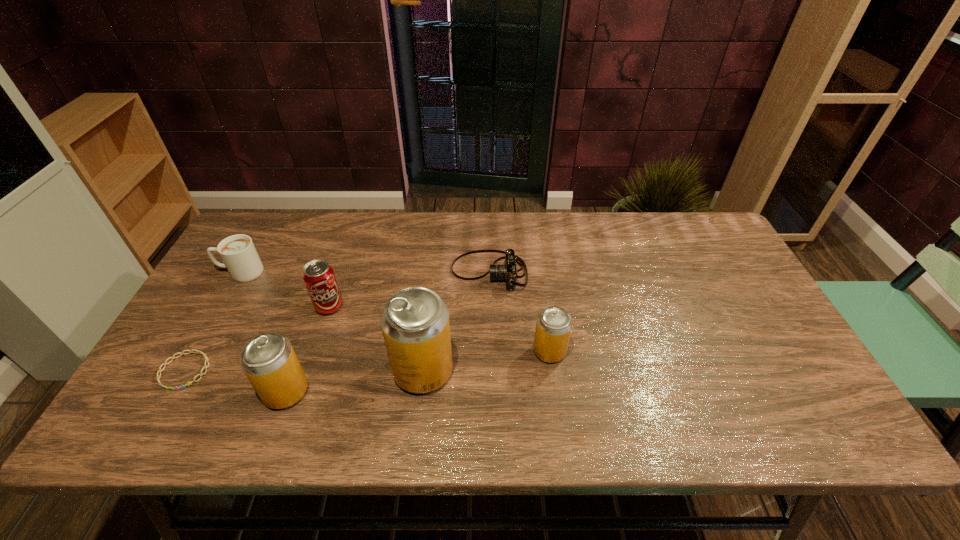
Please point out where to position a new pop (soda) on the right to maintain spacing. Please provide its 2D coordinates. Your answer should be formatted as a tuple, i.e. [(x, y)], where the tuple contains the x and y coordinates of a point satisfying the conditions above.

[(667, 333)]